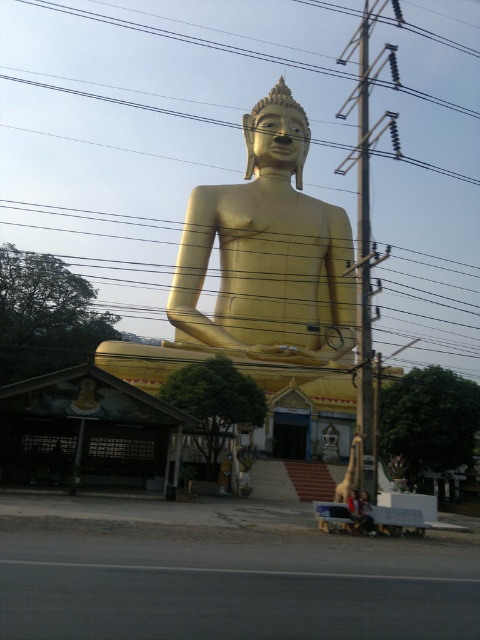
Question: Is black wire at upper center smaller than matte gold statue at center?

Choices:
 (A) no
 (B) yes

Answer: (A)

Question: Which point is closer to the camera?

Choices:
 (A) matte gold statue at center
 (B) metallic pole at right
 (C) gold polished statue at center
 (D) black wire at upper center

Answer: (A)

Question: Does gold polished statue at center have a greater width compared to metallic pole at right?

Choices:
 (A) no
 (B) yes

Answer: (B)

Question: Among these objects, which one is farthest from the camera?

Choices:
 (A) gold polished statue at center
 (B) metallic pole at right
 (C) matte gold statue at center
 (D) black wire at upper center

Answer: (A)

Question: Which object is farther from the camera taking this photo?

Choices:
 (A) black wire at upper center
 (B) gold polished statue at center
 (C) metallic pole at right

Answer: (B)

Question: Is gold polished statue at center wider than matte gold statue at center?

Choices:
 (A) no
 (B) yes

Answer: (B)